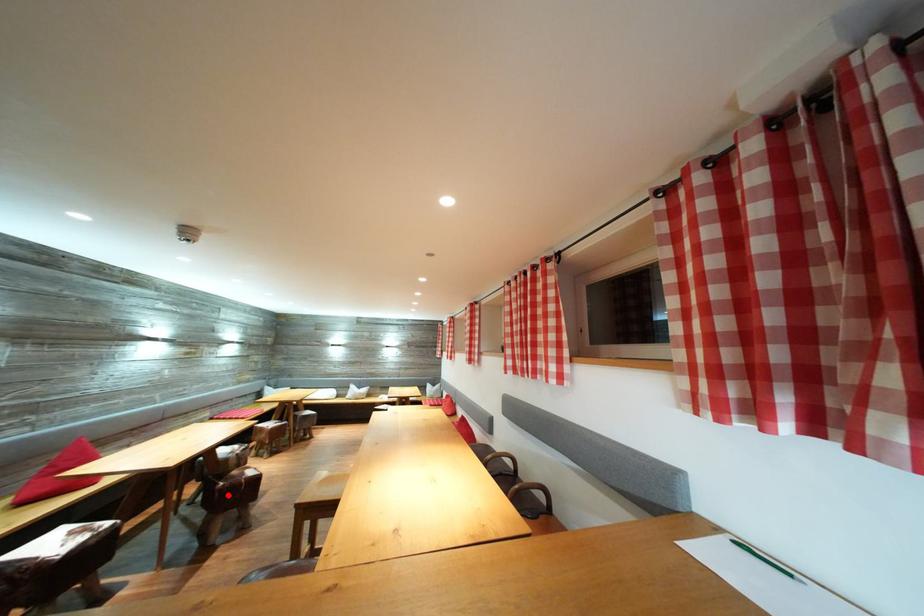
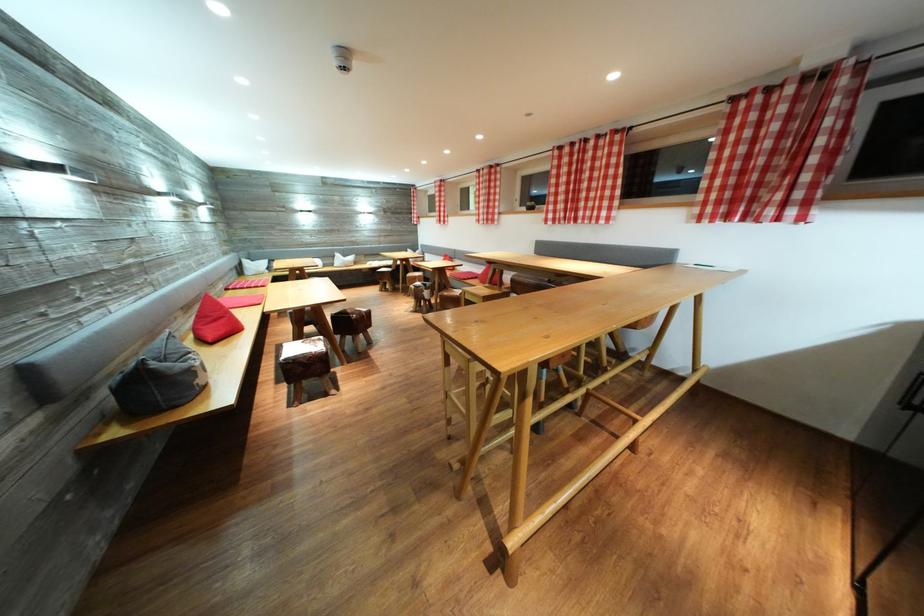
In the second image, find the point that corresponds to the highlighted location in the first image.

(362, 325)